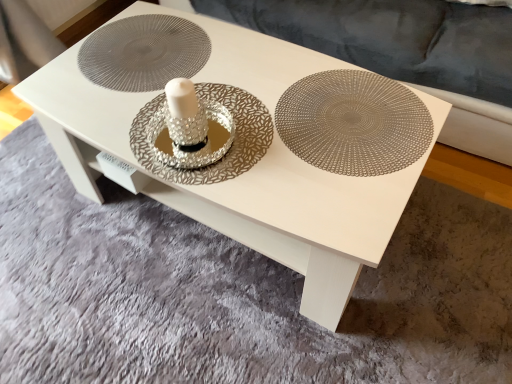
Question: Considering the relative sizes of velvet grey couch at upper center and metallic silver doily at center in the image provided, is velvet grey couch at upper center shorter than metallic silver doily at center?

Choices:
 (A) no
 (B) yes

Answer: (A)

Question: Considering the relative positions of velvet grey couch at upper center and metallic silver doily at center in the image provided, is velvet grey couch at upper center to the right of metallic silver doily at center from the viewer's perspective?

Choices:
 (A) no
 (B) yes

Answer: (B)

Question: From the image's perspective, is velvet grey couch at upper center on top of metallic silver doily at center?

Choices:
 (A) yes
 (B) no

Answer: (A)

Question: From the image's perspective, is velvet grey couch at upper center beneath metallic silver doily at center?

Choices:
 (A) yes
 (B) no

Answer: (B)

Question: Is velvet grey couch at upper center thinner than metallic silver doily at center?

Choices:
 (A) no
 (B) yes

Answer: (A)

Question: Would you say velvet grey couch at upper center is a long distance from metallic silver doily at center?

Choices:
 (A) no
 (B) yes

Answer: (A)

Question: Is metallic silver plate at center not inside velvet grey couch at upper center?

Choices:
 (A) no
 (B) yes

Answer: (B)

Question: Does metallic silver plate at center have a lesser width compared to velvet grey couch at upper center?

Choices:
 (A) yes
 (B) no

Answer: (A)

Question: From a real-world perspective, is metallic silver plate at center positioned under velvet grey couch at upper center based on gravity?

Choices:
 (A) yes
 (B) no

Answer: (B)

Question: Can you confirm if metallic silver plate at center is shorter than velvet grey couch at upper center?

Choices:
 (A) no
 (B) yes

Answer: (B)

Question: Is metallic silver plate at center closer to camera compared to velvet grey couch at upper center?

Choices:
 (A) no
 (B) yes

Answer: (B)

Question: Is metallic silver plate at center at the right side of velvet grey couch at upper center?

Choices:
 (A) yes
 (B) no

Answer: (B)

Question: Is metallic silver doily at center in front of metallic silver plate at center?

Choices:
 (A) yes
 (B) no

Answer: (B)